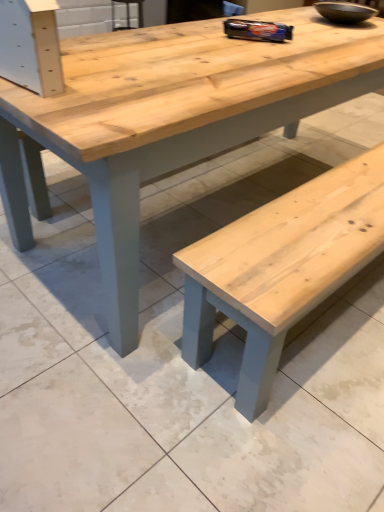
Question: In terms of width, does matte black bowl at upper right look wider or thinner when compared to natural wood table at center?

Choices:
 (A) wide
 (B) thin

Answer: (B)

Question: From the image's perspective, is matte black bowl at upper right positioned above or below natural wood table at center?

Choices:
 (A) below
 (B) above

Answer: (B)

Question: Is matte black bowl at upper right inside or outside of natural wood table at center?

Choices:
 (A) inside
 (B) outside

Answer: (B)

Question: Would you say natural wood table at center is inside or outside matte black bowl at upper right?

Choices:
 (A) outside
 (B) inside

Answer: (A)

Question: Visually, is natural wood table at center positioned to the left or to the right of matte black bowl at upper right?

Choices:
 (A) left
 (B) right

Answer: (A)

Question: Based on their sizes in the image, would you say natural wood table at center is bigger or smaller than matte black bowl at upper right?

Choices:
 (A) small
 (B) big

Answer: (B)

Question: From the image's perspective, is natural wood table at center positioned above or below matte black bowl at upper right?

Choices:
 (A) below
 (B) above

Answer: (A)